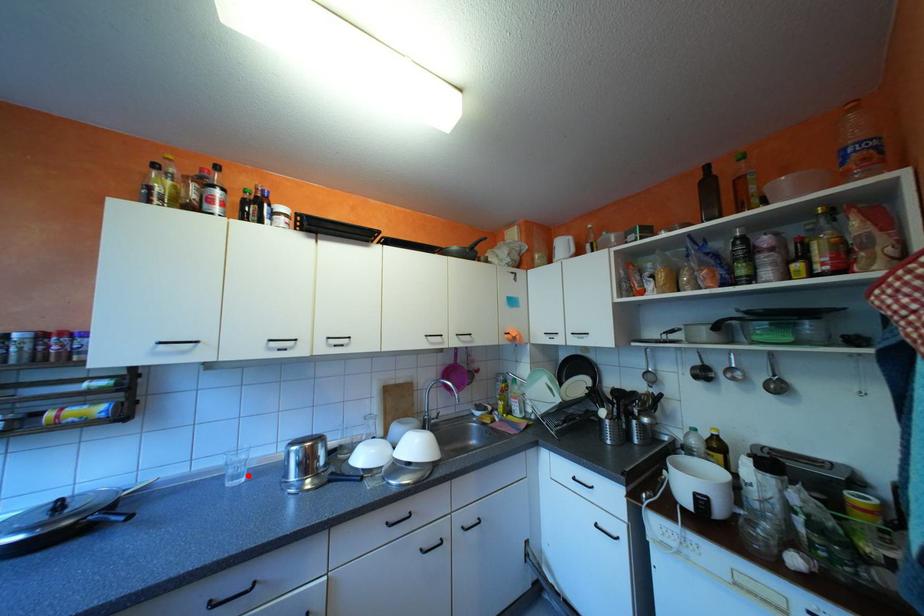
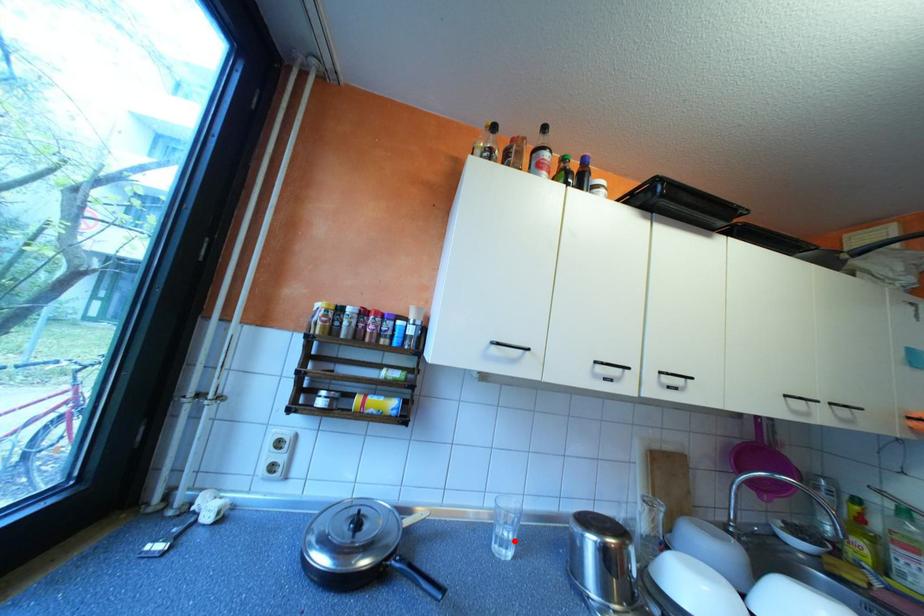
I am providing you with two images of the same scene from different viewpoints. A red point is marked on the first image and another point is marked on the second image. Is the marked point in image1 the same physical position as the marked point in image2?

Yes